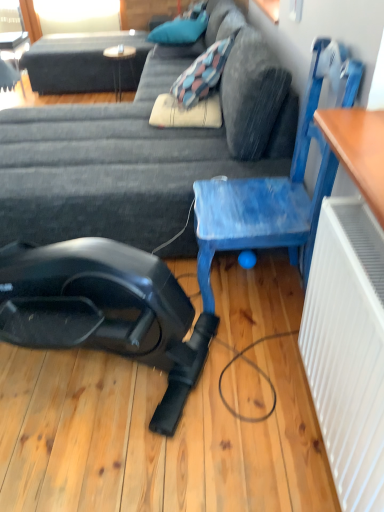
In order to face dark gray fabric couch at center, should I rotate leftwards or rightwards?

Rotate your view left by about 9.464°.

Find the location of `dark gray fabric couch at center`. dark gray fabric couch at center is located at coordinates [117, 165].

Find the location of a particular element. wooden table at upper center is located at coordinates (120, 64).

Is blue fabric pillow at upper center facing towards dark gray fabric couch at center?

Yes, blue fabric pillow at upper center is turned towards dark gray fabric couch at center.

Looking at the image, does blue fabric pillow at upper center seem bigger or smaller compared to dark gray fabric couch at center?

In the image, blue fabric pillow at upper center appears to be smaller than dark gray fabric couch at center.

Is point (167, 29) positioned in front of point (112, 149)?

No, (167, 29) is further to viewer.

Is point (108, 57) positioned behind point (238, 174)?

Yes, point (108, 57) is behind point (238, 174).

Would you consider wooden table at upper center to be distant from dark gray fabric couch at center?

wooden table at upper center is positioned a significant distance from dark gray fabric couch at center.

I want to click on studio couch on the right of wooden table at upper center, so click(x=117, y=165).

Between wooden table at upper center and dark gray fabric couch at center, which one has smaller width?

Thinner between the two is wooden table at upper center.

From a real-world perspective, between dark gray fabric couch at center and blue painted wood chair at center right, who is vertically lower?

dark gray fabric couch at center is physically lower.

Is dark gray fabric couch at center aimed at blue painted wood chair at center right?

No, dark gray fabric couch at center is not aimed at blue painted wood chair at center right.

How far apart are dark gray fabric couch at center and blue painted wood chair at center right?

dark gray fabric couch at center and blue painted wood chair at center right are 47.51 centimeters apart from each other.

Is dark gray fabric couch at center located outside blue painted wood chair at center right?

Absolutely, dark gray fabric couch at center is external to blue painted wood chair at center right.

Is the position of wooden table at upper center less distant than that of blue painted wood chair at center right?

No, wooden table at upper center is behind blue painted wood chair at center right.

Does wooden table at upper center have a lesser height compared to blue painted wood chair at center right?

Indeed, wooden table at upper center has a lesser height compared to blue painted wood chair at center right.

Considering the sizes of objects wooden table at upper center and blue painted wood chair at center right in the image provided, who is bigger, wooden table at upper center or blue painted wood chair at center right?

With larger size is blue painted wood chair at center right.

Between wooden table at upper center and blue painted wood chair at center right, which one has smaller width?

wooden table at upper center is thinner.

From their relative heights in the image, would you say blue painted wood chair at center right is taller or shorter than dark gray fabric couch at center?

Considering their sizes, blue painted wood chair at center right has more height than dark gray fabric couch at center.

Is blue painted wood chair at center right facing away from dark gray fabric couch at center?

blue painted wood chair at center right does not have its back to dark gray fabric couch at center.

From the image's perspective, is blue painted wood chair at center right on dark gray fabric couch at center?

No, from the image's perspective, blue painted wood chair at center right is not on top of dark gray fabric couch at center.

From the image's perspective, which is below, dark gray fabric couch at center or blue fabric pillow at upper center?

dark gray fabric couch at center.

Which object is further away from the camera taking this photo, dark gray fabric couch at center or blue fabric pillow at upper center?

blue fabric pillow at upper center is further from the camera.

Which is correct: dark gray fabric couch at center is inside blue fabric pillow at upper center, or outside of it?

dark gray fabric couch at center is located beyond the bounds of blue fabric pillow at upper center.

How many degrees apart are the facing directions of blue painted wood chair at center right and wooden table at upper center?

blue painted wood chair at center right and wooden table at upper center are facing 94.9 degrees away from each other.

From the image's perspective, between blue painted wood chair at center right and wooden table at upper center, who is located below?

blue painted wood chair at center right.

From a real-world perspective, is blue painted wood chair at center right physically located above or below wooden table at upper center?

From a real-world perspective, blue painted wood chair at center right is physically above wooden table at upper center.

Which object is wider, blue painted wood chair at center right or wooden table at upper center?

Wider between the two is blue painted wood chair at center right.

Where is `studio couch located in front of the blue fabric pillow at upper center`? The width and height of the screenshot is (384, 512). studio couch located in front of the blue fabric pillow at upper center is located at coordinates (117, 165).

Find the location of `studio couch below the wooden table at upper center (from the image's perspective)`. studio couch below the wooden table at upper center (from the image's perspective) is located at coordinates (117, 165).

From the picture: Looking at the image, which one is located further to blue painted wood chair at center right, wooden table at upper center or dark gray fabric couch at center?

Among the two, wooden table at upper center is located further to blue painted wood chair at center right.

Looking at the image, which one is located closer to blue fabric pillow at upper center, wooden table at upper center or dark gray fabric couch at center?

wooden table at upper center.

Estimate the real-world distances between objects in this image. Which object is further from blue fabric pillow at upper center, dark gray fabric couch at center or wooden table at upper center?

dark gray fabric couch at center is further to blue fabric pillow at upper center.

From the picture: From the image, which object appears to be nearer to dark gray fabric couch at center, wooden table at upper center or blue painted wood chair at center right?

The object closer to dark gray fabric couch at center is blue painted wood chair at center right.

Based on their spatial positions, is blue fabric pillow at upper center or dark gray fabric couch at center further from blue painted wood chair at center right?

blue fabric pillow at upper center.

Which object lies nearer to the anchor point blue fabric pillow at upper center, blue painted wood chair at center right or dark gray fabric couch at center?

The object closer to blue fabric pillow at upper center is dark gray fabric couch at center.

Which object lies nearer to the anchor point dark gray fabric couch at center, blue painted wood chair at center right or blue fabric pillow at upper center?

Based on the image, blue painted wood chair at center right appears to be nearer to dark gray fabric couch at center.

Looking at the image, which one is located further to blue painted wood chair at center right, dark gray fabric couch at center or wooden table at upper center?

The object further to blue painted wood chair at center right is wooden table at upper center.

At what (x,y) coordinates should I click in order to perform the action: click on studio couch between blue painted wood chair at center right and blue fabric pillow at upper center from front to back. Please return your answer as a coordinate pair (x, y). The height and width of the screenshot is (512, 384). Looking at the image, I should click on (117, 165).

At what (x,y) coordinates should I click in order to perform the action: click on pillow between blue painted wood chair at center right and wooden table at upper center from front to back. Please return your answer as a coordinate pair (x, y). This screenshot has height=512, width=384. Looking at the image, I should click on (x=179, y=30).

I want to click on pillow between dark gray fabric couch at center and wooden table at upper center in the front-back direction, so click(x=179, y=30).

Locate an element on the screen. This screenshot has width=384, height=512. studio couch located between blue painted wood chair at center right and wooden table at upper center in the depth direction is located at coordinates (117, 165).